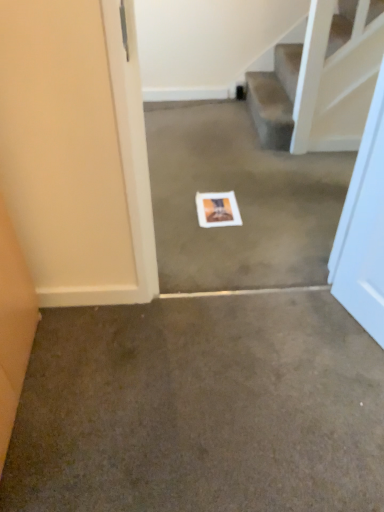
The width and height of the screenshot is (384, 512). Identify the location of free spot above white matte postcard at center (from a real-world perspective). (215, 206).